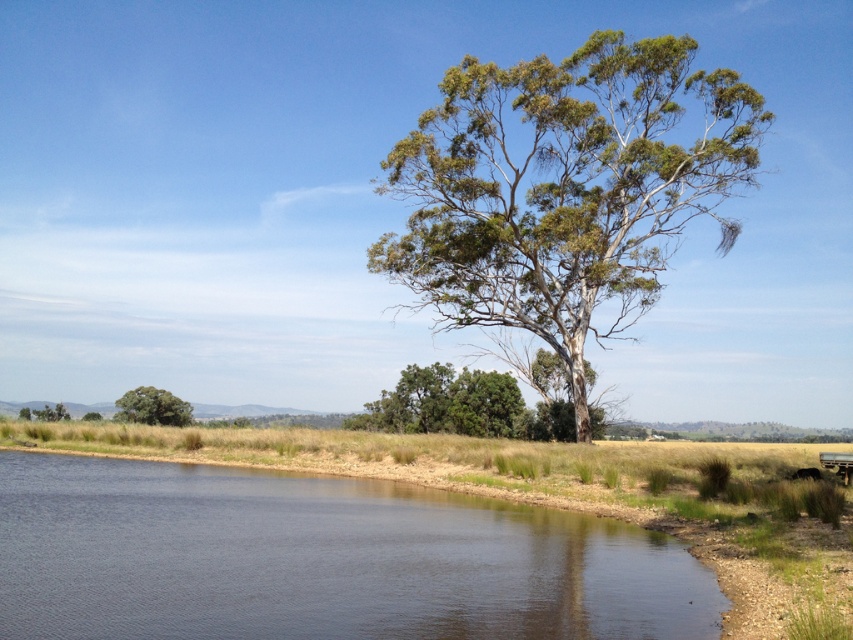
Looking at this image, is dark blue water at lower left wider than green leafy tree at lower left?

Correct, the width of dark blue water at lower left exceeds that of green leafy tree at lower left.

Between dark blue water at lower left and green leafy tree at lower left, which one appears on the left side from the viewer's perspective?

green leafy tree at lower left is more to the left.

Measure the distance between point (x=590, y=621) and camera.

A distance of 12.31 meters exists between point (x=590, y=621) and camera.

At what (x,y) coordinates should I click in order to perform the action: click on dark blue water at lower left. Please return your answer as a coordinate pair (x, y). Looking at the image, I should click on pyautogui.click(x=320, y=560).

Can you confirm if green leafy tree at center is wider than green matte tree at lower left?

Indeed, green leafy tree at center has a greater width compared to green matte tree at lower left.

Does point (606, 237) come in front of point (115, 400)?

Yes.

Describe the element at coordinates (564, 189) in the screenshot. I see `green leafy tree at center` at that location.

Identify the location of green leafy tree at center. The width and height of the screenshot is (853, 640). (564, 189).

Between dark blue water at lower left and green matte tree at lower left, which one is positioned higher?

dark blue water at lower left

Can you confirm if dark blue water at lower left is positioned above green matte tree at lower left?

Indeed, dark blue water at lower left is positioned over green matte tree at lower left.

Is point (323, 486) farther from viewer compared to point (148, 406)?

No, (323, 486) is in front of (148, 406).

This screenshot has width=853, height=640. In order to click on dark blue water at lower left in this screenshot , I will do `click(320, 560)`.